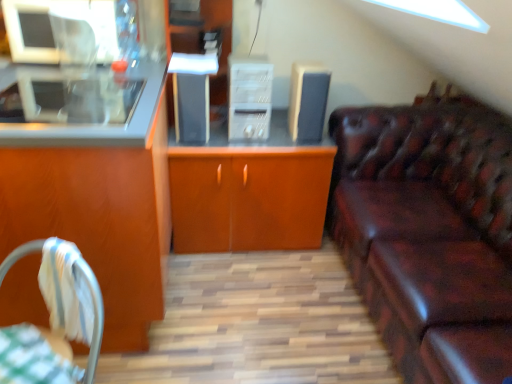
This screenshot has height=384, width=512. Describe the element at coordinates (33, 358) in the screenshot. I see `green checkered tablecloth at lower left` at that location.

Describe the element at coordinates (249, 97) in the screenshot. The width and height of the screenshot is (512, 384). I see `white plastic file cabinet at center` at that location.

Where is `white plastic file cabinet at center`? white plastic file cabinet at center is located at coordinates (249, 97).

In order to face satin black speaker at center, which appears as the second appliance when viewed from the right, should I rotate leftwards or rightwards?

To align with it, rotate left about 8.418°.

From the picture: Measure the distance between slate gray fabric speaker at upper center, marked as the 2th appliance in a left-to-right arrangement, and camera.

6.43 feet.

What are the coordinates of `wooden cabinet at center, which is the 1th cabinetry in right-to-left order` in the screenshot? It's located at (248, 197).

Do you think leather couch at right is within slate gray fabric speaker at upper center, marked as the 2th appliance in a left-to-right arrangement, or outside of it?

leather couch at right is located beyond the bounds of slate gray fabric speaker at upper center, marked as the 2th appliance in a left-to-right arrangement.

In terms of height, does leather couch at right look taller or shorter compared to slate gray fabric speaker at upper center, positioned as the 1th appliance in right-to-left order?

Considering their sizes, leather couch at right has more height than slate gray fabric speaker at upper center, positioned as the 1th appliance in right-to-left order.

Can you confirm if leather couch at right is wider than slate gray fabric speaker at upper center, positioned as the 1th appliance in right-to-left order?

Correct, the width of leather couch at right exceeds that of slate gray fabric speaker at upper center, positioned as the 1th appliance in right-to-left order.

Is green checkered tablecloth at lower left facing towards satin black speaker at center, which ranks as the first appliance in left-to-right order?

No.

From a real-world perspective, is green checkered tablecloth at lower left positioned above or below satin black speaker at center, which ranks as the first appliance in left-to-right order?

green checkered tablecloth at lower left is situated lower than satin black speaker at center, which ranks as the first appliance in left-to-right order, in the real world.

Are green checkered tablecloth at lower left and satin black speaker at center, which ranks as the first appliance in left-to-right order, located far from each other?

Yes.

Looking at the image, does green checkered tablecloth at lower left seem bigger or smaller compared to satin black speaker at center, which appears as the second appliance when viewed from the right?

Considering their sizes, green checkered tablecloth at lower left takes up more space than satin black speaker at center, which appears as the second appliance when viewed from the right.

Where is `tablecloth in front of the white plastic file cabinet at center`? This screenshot has width=512, height=384. tablecloth in front of the white plastic file cabinet at center is located at coordinates (33, 358).

From the image's perspective, is green checkered tablecloth at lower left positioned above or below white plastic file cabinet at center?

green checkered tablecloth at lower left is below white plastic file cabinet at center.

Between point (34, 343) and point (242, 122), which one is positioned in front?

Positioned in front is point (34, 343).

Is white plastic file cabinet at center a part of green checkered tablecloth at lower left?

Actually, white plastic file cabinet at center is outside green checkered tablecloth at lower left.

Is satin black speaker at center, which ranks as the first appliance in left-to-right order, at the left side of green checkered tablecloth at lower left?

In fact, satin black speaker at center, which ranks as the first appliance in left-to-right order, is to the right of green checkered tablecloth at lower left.

Considering the relative sizes of satin black speaker at center, which ranks as the first appliance in left-to-right order, and green checkered tablecloth at lower left in the image provided, is satin black speaker at center, which ranks as the first appliance in left-to-right order, thinner than green checkered tablecloth at lower left?

No.

Based on the photo, is satin black speaker at center, which ranks as the first appliance in left-to-right order, positioned before green checkered tablecloth at lower left?

No, it is behind green checkered tablecloth at lower left.

Does point (184, 74) come closer to viewer compared to point (28, 359)?

No, it is behind (28, 359).

Which is in front, slate gray fabric speaker at upper center, positioned as the 1th appliance in right-to-left order, or white fabric chair at lower left?

white fabric chair at lower left is closer to the camera.

How different are the orientations of slate gray fabric speaker at upper center, marked as the 2th appliance in a left-to-right arrangement, and white fabric chair at lower left in degrees?

The angle between the facing direction of slate gray fabric speaker at upper center, marked as the 2th appliance in a left-to-right arrangement, and the facing direction of white fabric chair at lower left is 24.9 degrees.

Locate an element on the screen. appliance that is the 2nd one when counting rightward from the white fabric chair at lower left is located at coordinates (308, 101).

Is green checkered tablecloth at lower left located within matte wood cabinet at left, which is the first cabinetry in left-to-right order?

No, green checkered tablecloth at lower left is not inside matte wood cabinet at left, which is the first cabinetry in left-to-right order.

Between matte wood cabinet at left, acting as the second cabinetry starting from the right, and green checkered tablecloth at lower left, which one appears on the left side from the viewer's perspective?

matte wood cabinet at left, acting as the second cabinetry starting from the right, is more to the left.

From a real-world perspective, who is located higher, matte wood cabinet at left, which is the first cabinetry in left-to-right order, or green checkered tablecloth at lower left?

From a 3D spatial view, matte wood cabinet at left, which is the first cabinetry in left-to-right order, is above.

From the image's perspective, is matte wood cabinet at left, which is the first cabinetry in left-to-right order, beneath green checkered tablecloth at lower left?

No.

From the image's perspective, starting from the white fabric chair at lower left, which cabinetry is the 1st one above? Please provide its 2D coordinates.

[(98, 165)]

From a real-world perspective, is white fabric chair at lower left under matte wood cabinet at left, acting as the second cabinetry starting from the right?

Indeed, from a real-world perspective, white fabric chair at lower left is positioned beneath matte wood cabinet at left, acting as the second cabinetry starting from the right.

Is white fabric chair at lower left not close to matte wood cabinet at left, which is the first cabinetry in left-to-right order?

They are positioned close to each other.

Considering the sizes of objects white fabric chair at lower left and matte wood cabinet at left, acting as the second cabinetry starting from the right, in the image provided, who is thinner, white fabric chair at lower left or matte wood cabinet at left, acting as the second cabinetry starting from the right,?

white fabric chair at lower left is thinner.

Identify the location of appliance that is the 2nd one when counting backward from the leather couch at right. (308, 101).

Locate an element on the screen. the 1st appliance counting from the right side of the green checkered tablecloth at lower left is located at coordinates (191, 108).

Estimate the real-world distances between objects in this image. Which object is closer to leather couch at right, wooden cabinet at center, which is the 1th cabinetry in right-to-left order, or white fabric chair at lower left?

wooden cabinet at center, which is the 1th cabinetry in right-to-left order, lies closer to leather couch at right than the other object.

Which object lies nearer to the anchor point slate gray fabric speaker at upper center, marked as the 2th appliance in a left-to-right arrangement, satin black speaker at center, which ranks as the first appliance in left-to-right order, or matte wood cabinet at left, acting as the second cabinetry starting from the right?

Based on the image, satin black speaker at center, which ranks as the first appliance in left-to-right order, appears to be nearer to slate gray fabric speaker at upper center, marked as the 2th appliance in a left-to-right arrangement.

Considering their positions, is white plastic file cabinet at center positioned further to wooden cabinet at center, which is the 1th cabinetry in right-to-left order, than white fabric chair at lower left?

white fabric chair at lower left.

Which object lies nearer to the anchor point leather couch at right, slate gray fabric speaker at upper center, positioned as the 1th appliance in right-to-left order, or green checkered tablecloth at lower left?

The object closer to leather couch at right is slate gray fabric speaker at upper center, positioned as the 1th appliance in right-to-left order.

Considering their positions, is green checkered tablecloth at lower left positioned further to white fabric chair at lower left than satin black speaker at center, which ranks as the first appliance in left-to-right order?

satin black speaker at center, which ranks as the first appliance in left-to-right order, is further to white fabric chair at lower left.

Estimate the real-world distances between objects in this image. Which object is closer to wooden cabinet at center, the 2th cabinetry when ordered from left to right, leather couch at right or white fabric chair at lower left?

Among the two, leather couch at right is located nearer to wooden cabinet at center, the 2th cabinetry when ordered from left to right.

Consider the image. Estimate the real-world distances between objects in this image. Which object is closer to white plastic file cabinet at center, wooden cabinet at center, which is the 1th cabinetry in right-to-left order, or white fabric chair at lower left?

wooden cabinet at center, which is the 1th cabinetry in right-to-left order, is positioned closer to the anchor white plastic file cabinet at center.

Which object lies further to the anchor point white plastic file cabinet at center, satin black speaker at center, which appears as the second appliance when viewed from the right, or leather couch at right?

leather couch at right.

Locate an element on the screen. Image resolution: width=512 pixels, height=384 pixels. tablecloth positioned between white fabric chair at lower left and satin black speaker at center, which appears as the second appliance when viewed from the right, from near to far is located at coordinates (33, 358).

Locate an element on the screen. The width and height of the screenshot is (512, 384). tablecloth between matte wood cabinet at left, acting as the second cabinetry starting from the right, and slate gray fabric speaker at upper center, positioned as the 1th appliance in right-to-left order, from left to right is located at coordinates (33, 358).

Where is `appliance located between white fabric chair at lower left and white plastic file cabinet at center in the depth direction`? appliance located between white fabric chair at lower left and white plastic file cabinet at center in the depth direction is located at coordinates [x=191, y=108].

Where is `appliance between matte wood cabinet at left, which is the first cabinetry in left-to-right order, and white plastic file cabinet at center, along the z-axis`? This screenshot has height=384, width=512. appliance between matte wood cabinet at left, which is the first cabinetry in left-to-right order, and white plastic file cabinet at center, along the z-axis is located at coordinates (191, 108).